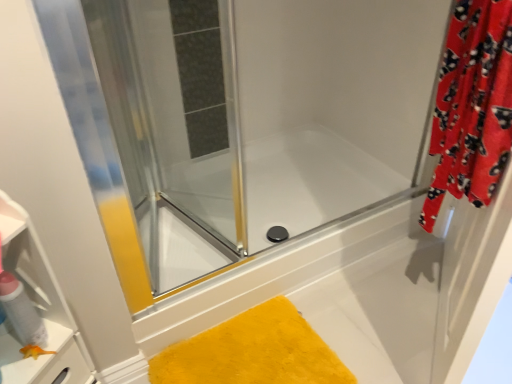
Question: Could you tell me if red fuzzy curtain at right is turned towards transparent glass shower door at upper left?

Choices:
 (A) yes
 (B) no

Answer: (A)

Question: Does red fuzzy curtain at right appear on the left side of transparent glass shower door at upper left?

Choices:
 (A) yes
 (B) no

Answer: (B)

Question: Is red fuzzy curtain at right positioned far away from transparent glass shower door at upper left?

Choices:
 (A) no
 (B) yes

Answer: (A)

Question: Is red fuzzy curtain at right not inside transparent glass shower door at upper left?

Choices:
 (A) no
 (B) yes

Answer: (B)

Question: Is red fuzzy curtain at right to the right of transparent glass shower door at upper left from the viewer's perspective?

Choices:
 (A) yes
 (B) no

Answer: (A)

Question: From the image's perspective, is red fuzzy curtain at right beneath transparent glass shower door at upper left?

Choices:
 (A) yes
 (B) no

Answer: (A)

Question: Is there a large distance between matte white spray can at left and transparent glass shower door at upper left?

Choices:
 (A) no
 (B) yes

Answer: (A)

Question: From a real-world perspective, does matte white spray can at left sit lower than transparent glass shower door at upper left?

Choices:
 (A) no
 (B) yes

Answer: (B)

Question: Does matte white spray can at left appear on the right side of transparent glass shower door at upper left?

Choices:
 (A) no
 (B) yes

Answer: (A)

Question: Is matte white spray can at left bigger than transparent glass shower door at upper left?

Choices:
 (A) yes
 (B) no

Answer: (B)

Question: Can you confirm if matte white spray can at left is positioned to the left of transparent glass shower door at upper left?

Choices:
 (A) no
 (B) yes

Answer: (B)

Question: Is matte white spray can at left not inside transparent glass shower door at upper left?

Choices:
 (A) yes
 (B) no

Answer: (A)

Question: From the image's perspective, is transparent glass shower door at upper left above red fuzzy curtain at right?

Choices:
 (A) yes
 (B) no

Answer: (A)